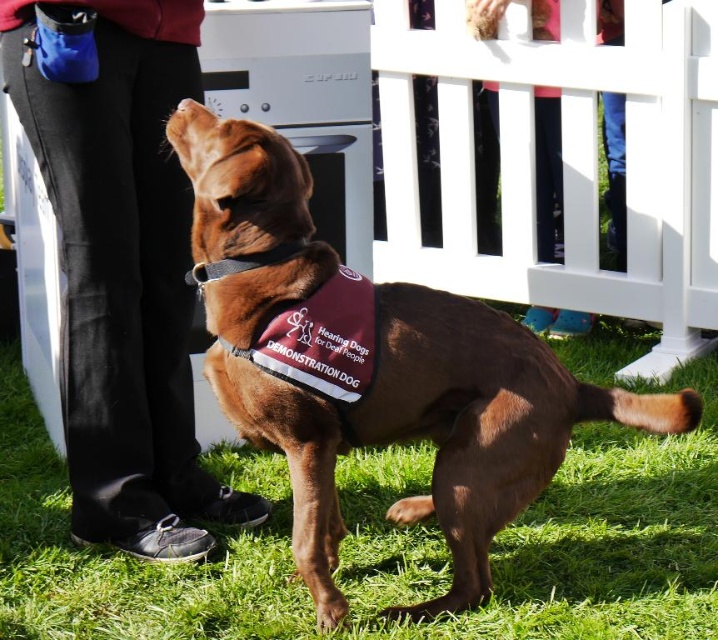
Who is more distant from viewer, (488, 12) or (202, 275)?

The point (488, 12) is behind.

Which is above, pink fabric at upper center or black leather neckband at center?

pink fabric at upper center is higher up.

Is point (533, 22) behind point (205, 262)?

That is True.

The width and height of the screenshot is (718, 640). Find the location of `pink fabric at upper center`. pink fabric at upper center is located at coordinates (549, 172).

The width and height of the screenshot is (718, 640). In order to click on green grass at lower center in this screenshot , I will do `click(383, 545)`.

Looking at this image, is green grass at lower center smaller than pink fabric at upper center?

Incorrect, green grass at lower center is not smaller in size than pink fabric at upper center.

The width and height of the screenshot is (718, 640). In order to click on green grass at lower center in this screenshot , I will do `click(383, 545)`.

What do you see at coordinates (381, 372) in the screenshot? This screenshot has height=640, width=718. I see `brown fabric vest at center` at bounding box center [381, 372].

Describe the element at coordinates (381, 372) in the screenshot. This screenshot has width=718, height=640. I see `brown fabric vest at center` at that location.

Identify the location of brown fabric vest at center. The image size is (718, 640). (381, 372).